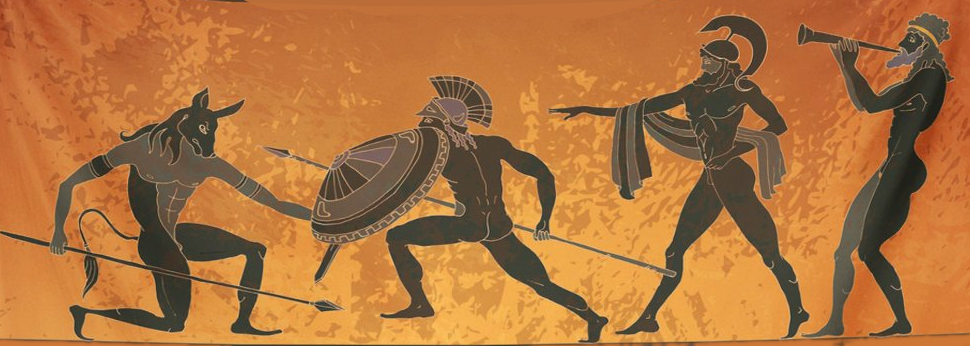
What are the coordinates of `drape` in the screenshot? It's located at (767, 141).